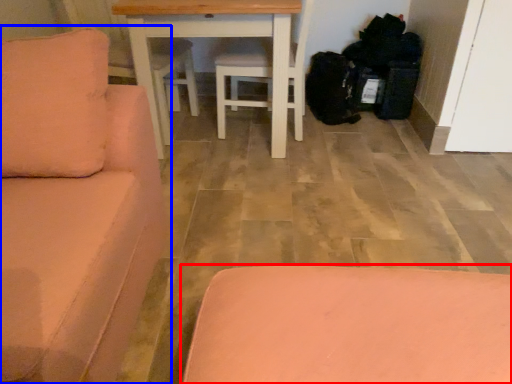
Question: Which object appears farthest to the camera in this image, furniture (highlighted by a red box) or studio couch (highlighted by a blue box)?

Choices:
 (A) furniture
 (B) studio couch

Answer: (A)